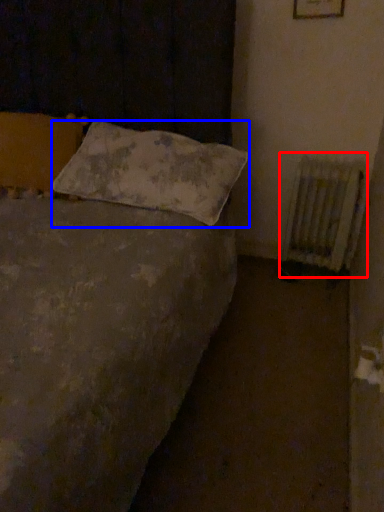
Question: Which of the following is the farthest to the observer, radiator (highlighted by a red box) or pillow (highlighted by a blue box)?

Choices:
 (A) radiator
 (B) pillow

Answer: (A)